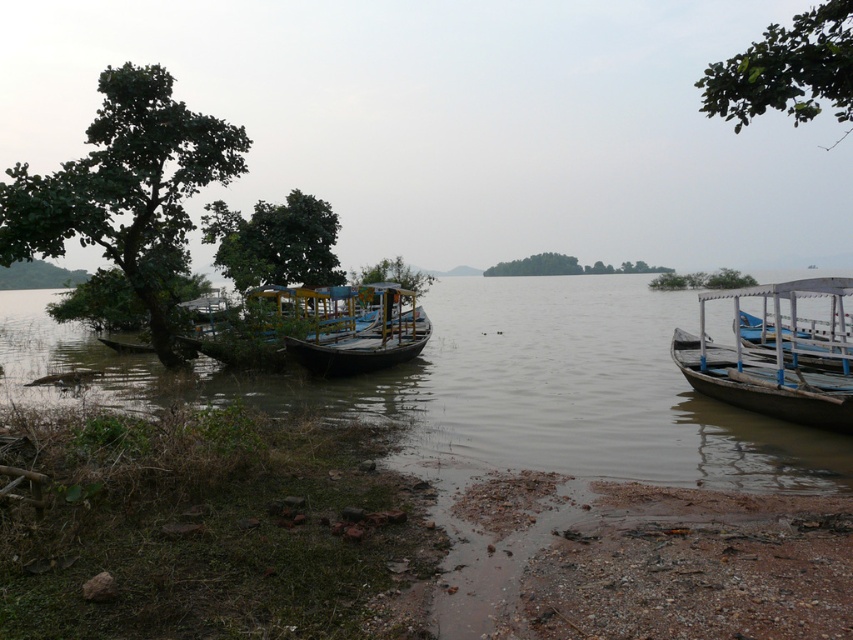
You are a photographer wanting to capture both the green leafy tree at center and the green matte tree at center in a single frame. What is the minimum distance you need to move backward to ensure both trees are fully visible?

The green leafy tree at center and the green matte tree at center are 11.21 meters apart. To capture both in a single frame, you need to move back at least 11.21 meters so that the entire distance between them fits within your camera view.

You are standing at the point marked by coordinates point (492,387). Looking around, you see the brown wooden boats at lower left. Which direction should you walk to reach the tree on the left side?

Since the point (492,387) marks the brown wooden boats at lower left, you are already at the location of the brown wooden boats at lower left. To reach the tree on the left side, you should walk towards the left from your current position.